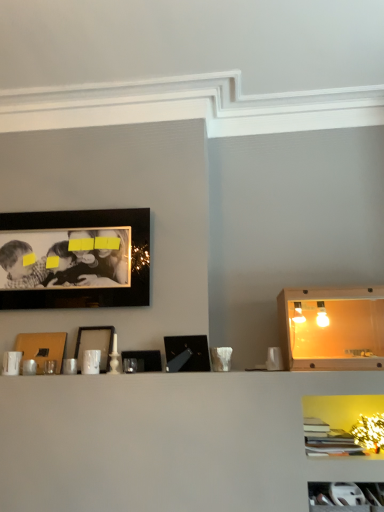
The width and height of the screenshot is (384, 512). Identify the location of empty space that is ontop of white plastic cabinet at lower right, the 1th cabinet in the bottom-to-top sequence (from a real-world perspective). (339, 487).